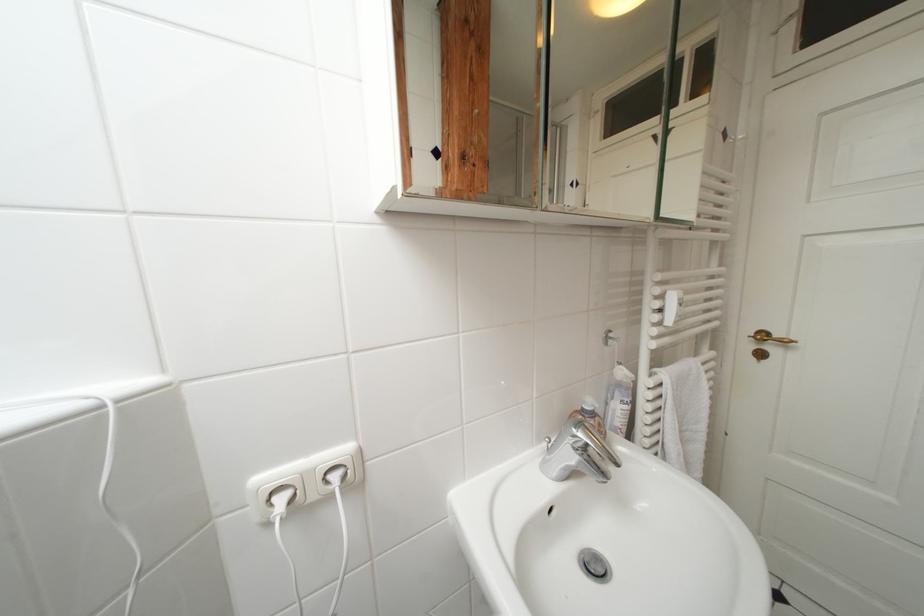
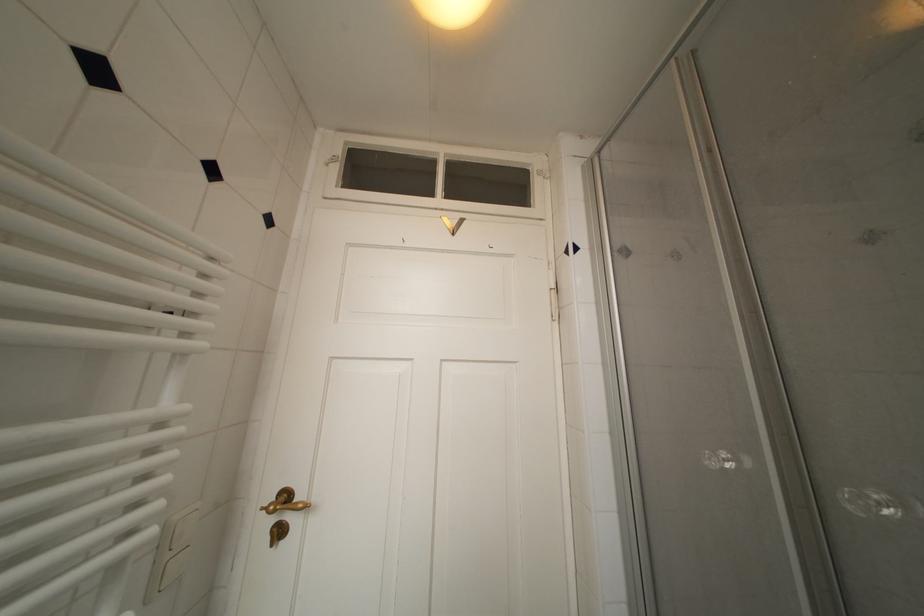
The point at (769, 339) is marked in the first image. Where is the corresponding point in the second image?

(293, 500)